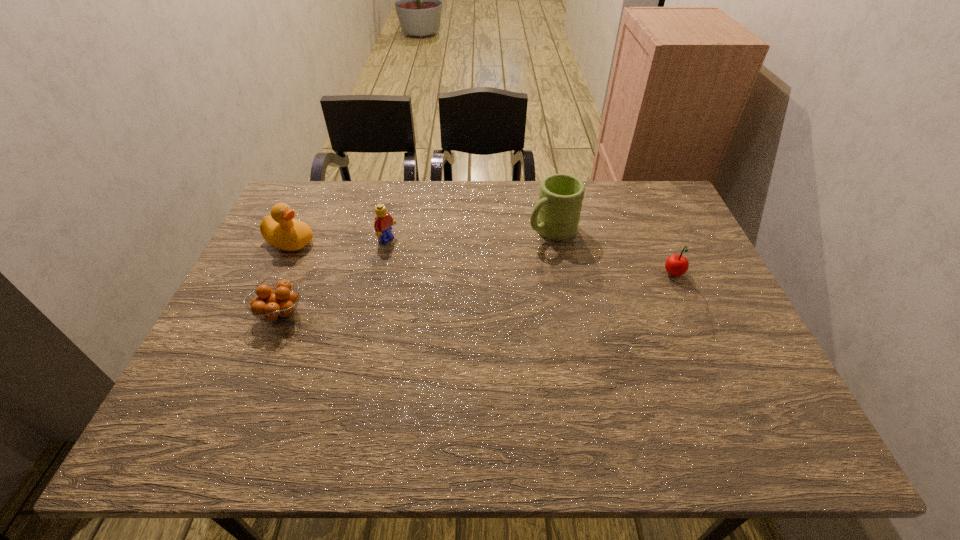
Point out which object is positioned as the third nearest to the second nearest object. Please provide its 2D coordinates. Your answer should be formatted as a tuple, i.e. [(x, y)], where the tuple contains the x and y coordinates of a point satisfying the conditions above.

[(280, 304)]

In order to click on vacant position in the image that satisfies the following two spatial constraints: 1. on the back side of the shortest object; 2. on the right side of the cherry in this screenshot , I will do `click(297, 275)`.

Image resolution: width=960 pixels, height=540 pixels. I want to click on free space that satisfies the following two spatial constraints: 1. on the back side of the Lego; 2. on the left side of the duck, so click(x=290, y=240).

At what (x,y) coordinates should I click in order to perform the action: click on vacant point that satisfies the following two spatial constraints: 1. on the back side of the second object from right to left; 2. on the right side of the Lego. Please return your answer as a coordinate pair (x, y). Image resolution: width=960 pixels, height=540 pixels. Looking at the image, I should click on (390, 231).

Identify the location of free space that satisfies the following two spatial constraints: 1. on the back side of the orange fruit; 2. on the left side of the cherry. (297, 275).